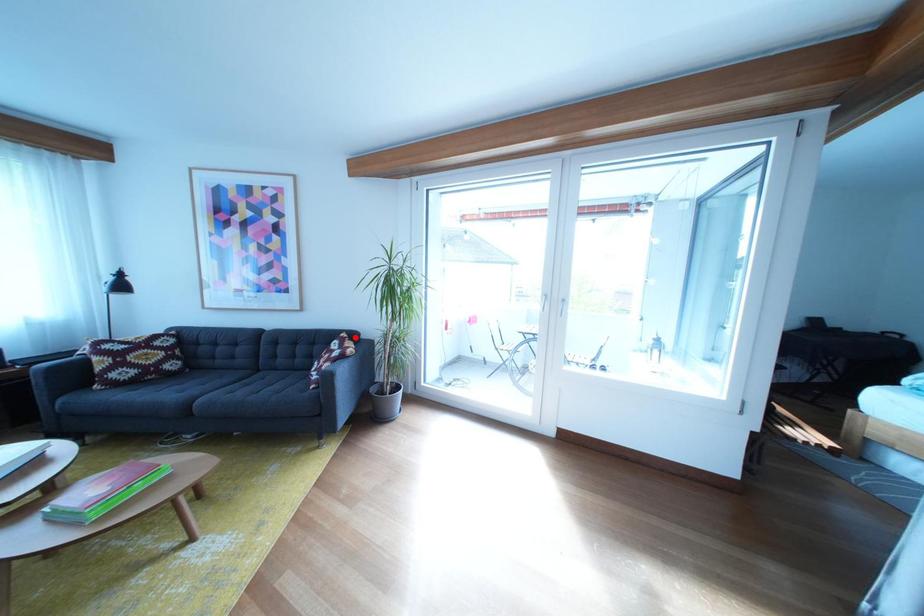
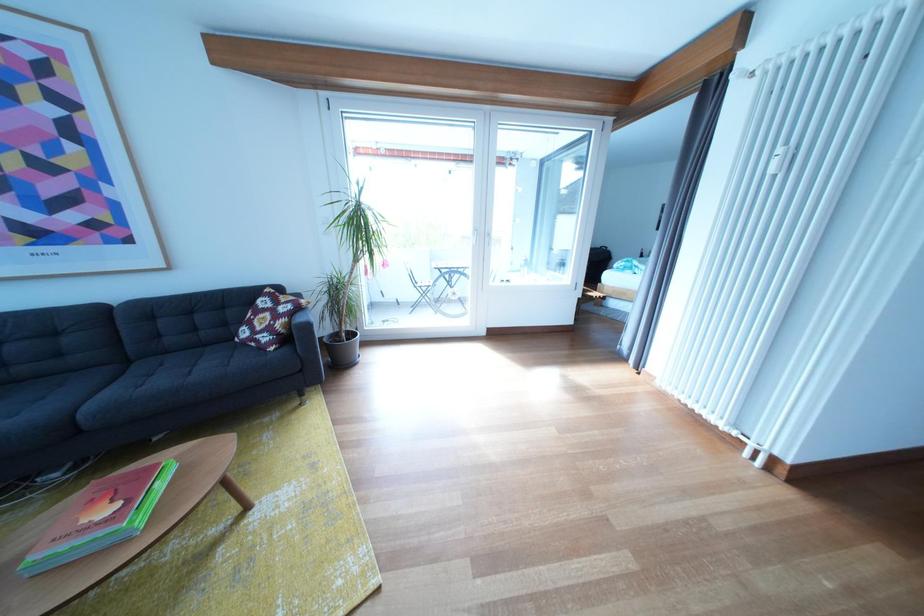
Question: I am providing you with two images of the same scene from different viewpoints. Given a red point in image1, look at the same physical point in image2. Is it:

Choices:
 (A) Closer to the viewpoint
 (B) Farther from the viewpoint

Answer: (A)